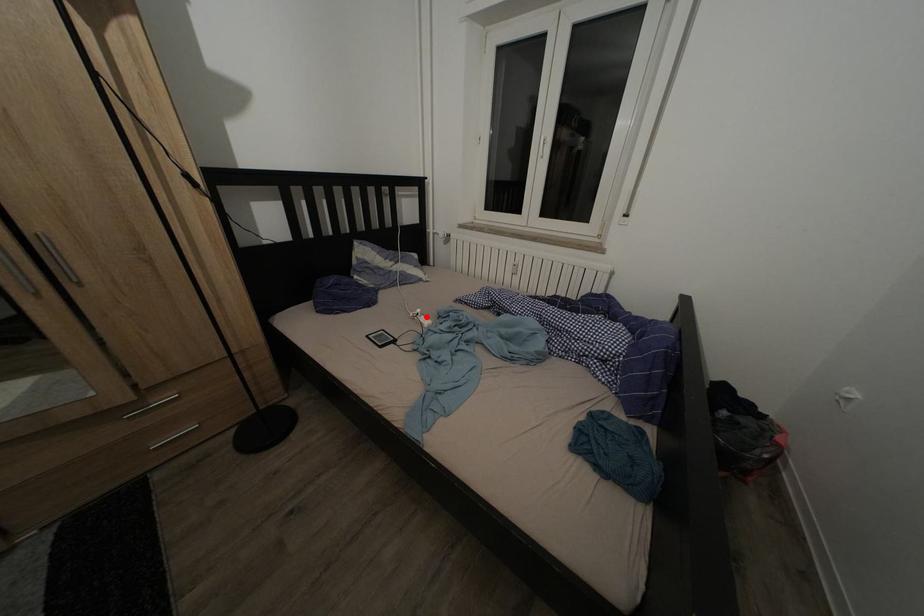
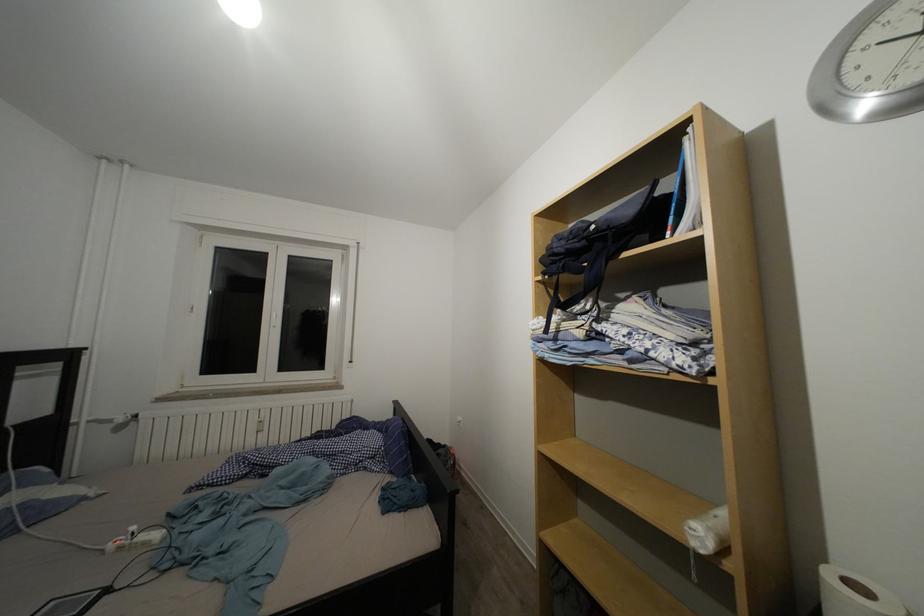
In the second image, find the point that corresponds to the highlighted location in the first image.

(140, 533)